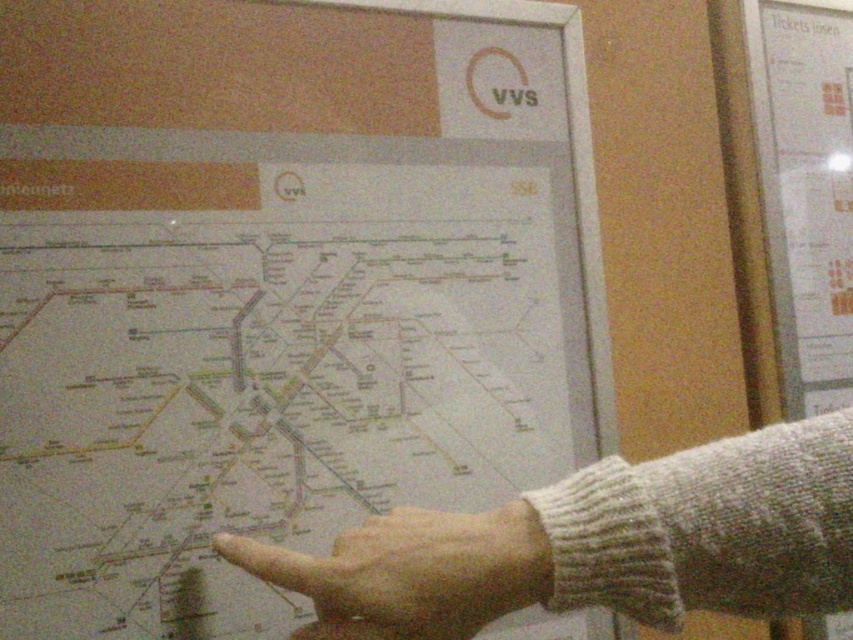
Which of these two, gray knitted sweater at center or skinny white finger at center, stands taller?

With more height is gray knitted sweater at center.

Can you confirm if gray knitted sweater at center is bigger than skinny white finger at center?

Yes, gray knitted sweater at center is bigger than skinny white finger at center.

Between point (790, 506) and point (407, 513), which one is positioned in front?

Point (790, 506) is more forward.

Where is `gray knitted sweater at center`? This screenshot has width=853, height=640. gray knitted sweater at center is located at coordinates (601, 544).

Does white paper map at center have a greater height compared to skinny white finger at center?

Yes, white paper map at center is taller than skinny white finger at center.

Is white paper map at center to the right of skinny white finger at center from the viewer's perspective?

Incorrect, white paper map at center is not on the right side of skinny white finger at center.

Which is behind, point (292, 122) or point (357, 582)?

The point (292, 122) is behind.

Locate an element on the screen. white paper map at center is located at coordinates (280, 288).

From the picture: Who is more forward, (102, 424) or (538, 500)?

Point (538, 500) is in front.

Does point (242, 513) lie in front of point (305, 566)?

No.

Where is `white paper map at center`? This screenshot has width=853, height=640. white paper map at center is located at coordinates (280, 288).